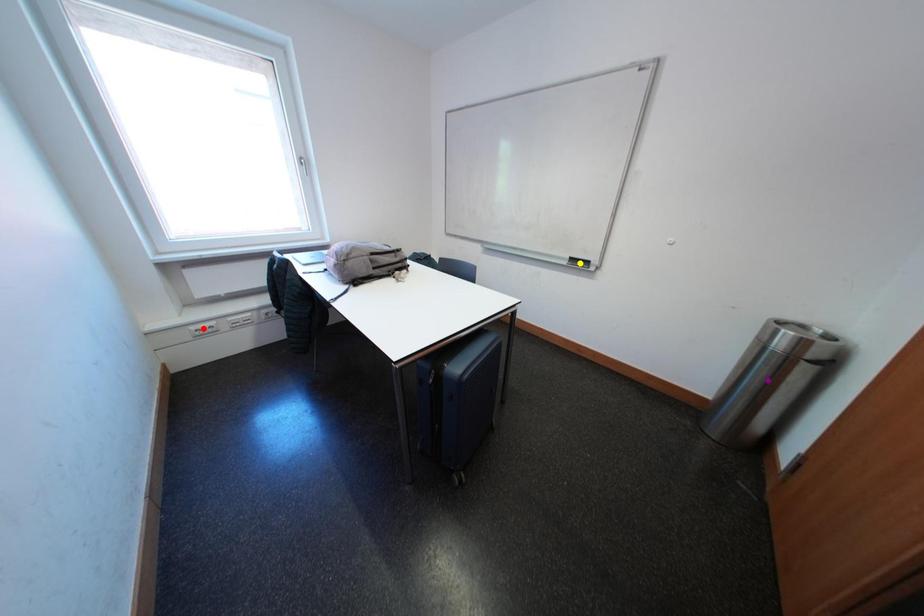
Order these from nearest to farthest:
- red point
- yellow point
- purple point

purple point
red point
yellow point